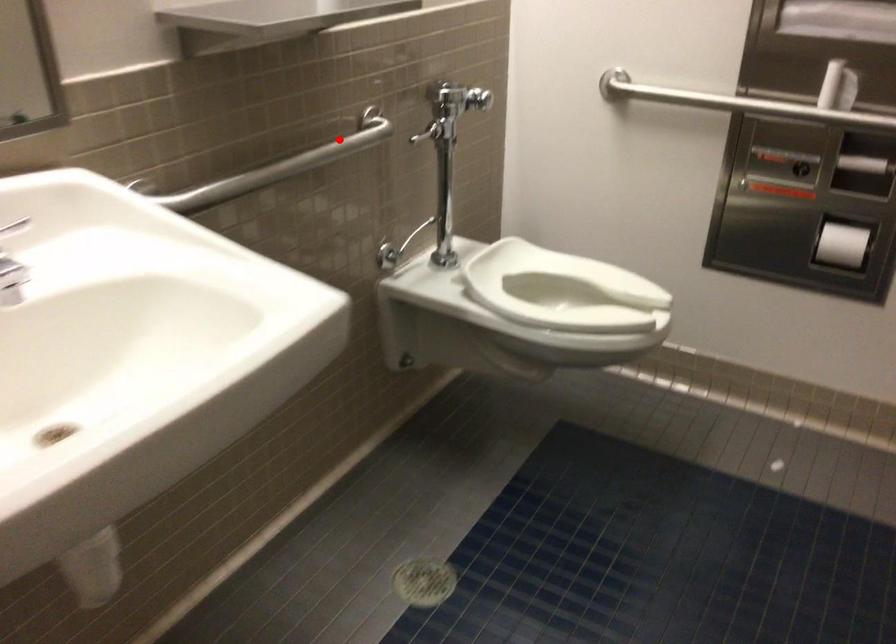
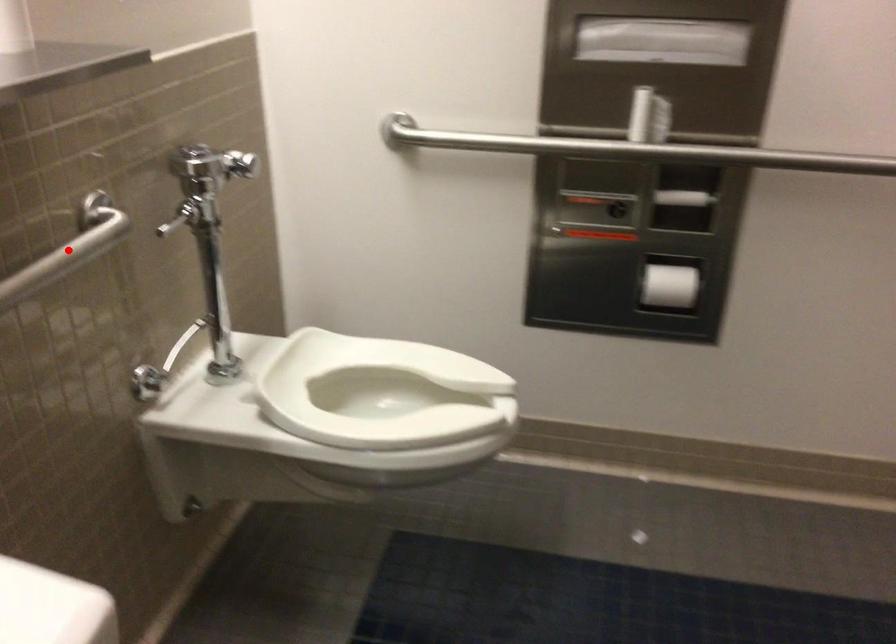
I am providing you with two images of the same scene from different viewpoints. A red point is marked on the first image and another point is marked on the second image. Are the points marked in image1 and image2 representing the same 3D position?

Yes